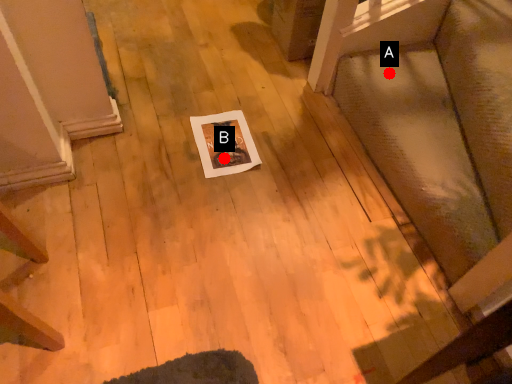
Question: Two points are circled on the image, labeled by A and B beside each circle. Which point appears farthest from the camera in this image?

Choices:
 (A) A is further
 (B) B is further

Answer: (A)